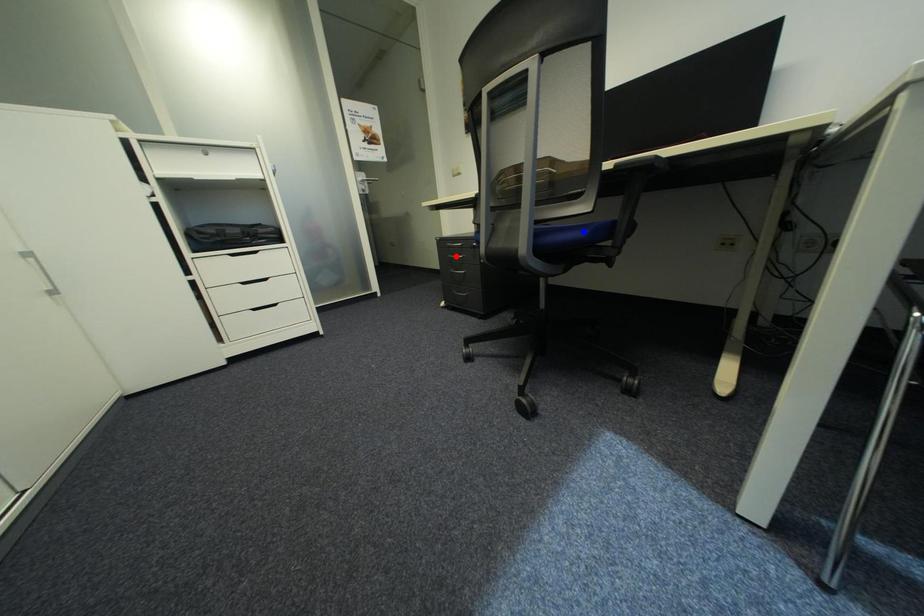
Question: Two points are marked on the image. Which point is closer to the camera?

Choices:
 (A) Blue point is closer.
 (B) Red point is closer.

Answer: (A)